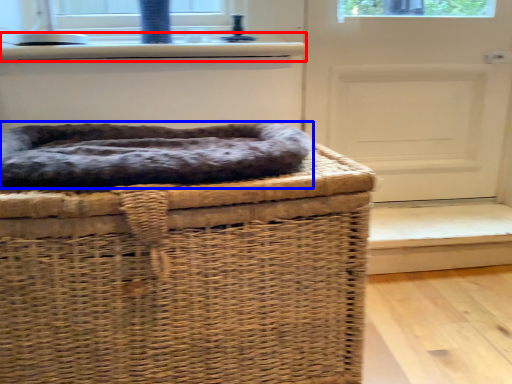
Question: Which of the following is the closest to the observer, window sill (highlighted by a red box) or dog bed (highlighted by a blue box)?

Choices:
 (A) window sill
 (B) dog bed

Answer: (B)